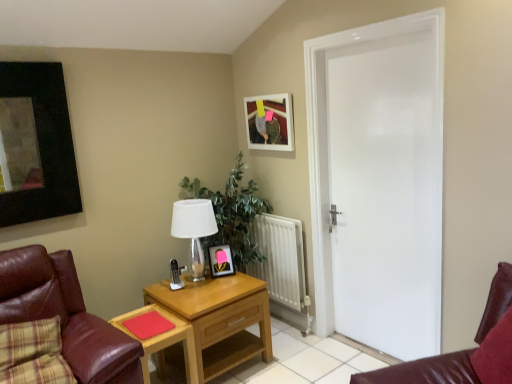
The height and width of the screenshot is (384, 512). I want to click on white glass table lamp at center, so click(194, 230).

This screenshot has height=384, width=512. Describe the element at coordinates (378, 181) in the screenshot. I see `white glossy door at right` at that location.

Describe the element at coordinates (221, 261) in the screenshot. I see `matte black picture frame at center, which is counted as the first picture frame, starting from the bottom` at that location.

This screenshot has width=512, height=384. What do you see at coordinates (220, 319) in the screenshot?
I see `wooden nightstand at center` at bounding box center [220, 319].

Identify the location of green leafy plant at center. (231, 214).

The height and width of the screenshot is (384, 512). I want to click on white glass table lamp at center, so click(194, 230).

Is white metallic radiator at center in front of or behind matte black picture frame at center, the 2th picture frame from the right, in the image?

In the image, white metallic radiator at center appears behind matte black picture frame at center, the 2th picture frame from the right.

Between white metallic radiator at center and matte black picture frame at center, the 1th picture frame from the left, which one has larger size?

white metallic radiator at center is bigger.

Looking at this image, is white metallic radiator at center facing away from matte black picture frame at center, which is counted as the first picture frame, starting from the bottom?

That's not correct — white metallic radiator at center is not looking away from matte black picture frame at center, which is counted as the first picture frame, starting from the bottom.

Is white metallic radiator at center positioned beyond the bounds of matte black picture frame at center, which is counted as the first picture frame, starting from the bottom?

Absolutely, white metallic radiator at center is external to matte black picture frame at center, which is counted as the first picture frame, starting from the bottom.

From a real-world perspective, relative to white glass table lamp at center, is green leafy plant at center vertically above or below?

In terms of real-world spatial position, green leafy plant at center is below white glass table lamp at center.

Is green leafy plant at center directly adjacent to white glass table lamp at center?

No, green leafy plant at center is not next to white glass table lamp at center.

In the image, is green leafy plant at center positioned in front of or behind white glass table lamp at center?

In the image, green leafy plant at center appears behind white glass table lamp at center.

Considering the positions of point (216, 238) and point (180, 237), is point (216, 238) closer or farther from the camera than point (180, 237)?

Point (216, 238).

How different are the orientations of white glass table lamp at center and matte black picture frame at center, which is counted as the first picture frame, starting from the bottom, in degrees?

The angle between the facing direction of white glass table lamp at center and the facing direction of matte black picture frame at center, which is counted as the first picture frame, starting from the bottom, is 24.7 degrees.

From a real-world perspective, which is physically above, white glass table lamp at center or matte black picture frame at center, the 2th picture frame from the right?

In real-world perspective, white glass table lamp at center is above.

Which is in front, point (201, 271) or point (219, 256)?

The point (201, 271) is in front.

Considering the sizes of objects white glass table lamp at center and matte black picture frame at center, which is counted as the first picture frame, starting from the bottom, in the image provided, who is thinner, white glass table lamp at center or matte black picture frame at center, which is counted as the first picture frame, starting from the bottom,?

matte black picture frame at center, which is counted as the first picture frame, starting from the bottom.

Is matte black picture frame at center, placed as the 2th picture frame when sorted from top to bottom, to the right of white glossy door at right from the viewer's perspective?

Incorrect, matte black picture frame at center, placed as the 2th picture frame when sorted from top to bottom, is not on the right side of white glossy door at right.

Based on the photo, considering the relative sizes of matte black picture frame at center, the 2th picture frame from the right, and white glossy door at right in the image provided, is matte black picture frame at center, the 2th picture frame from the right, bigger than white glossy door at right?

Incorrect, matte black picture frame at center, the 2th picture frame from the right, is not larger than white glossy door at right.

Is matte black picture frame at center, which is counted as the first picture frame, starting from the bottom, taller than white glossy door at right?

No, matte black picture frame at center, which is counted as the first picture frame, starting from the bottom, is not taller than white glossy door at right.

In the image, is matte black picture frame at center, placed as the 2th picture frame when sorted from top to bottom, positioned in front of or behind white glossy door at right?

matte black picture frame at center, placed as the 2th picture frame when sorted from top to bottom, is behind white glossy door at right.

Between white glass table lamp at center and wooden nightstand at center, which one has larger size?

wooden nightstand at center.

Can you tell me how much white glass table lamp at center and wooden nightstand at center differ in facing direction?

They differ by 0.000782 degrees in their facing directions.

Which object is thinner, white glass table lamp at center or wooden nightstand at center?

With smaller width is white glass table lamp at center.

Is white glass table lamp at center inside or outside of wooden nightstand at center?

white glass table lamp at center is not enclosed by wooden nightstand at center.

Does leather at left have a greater width compared to white metallic radiator at center?

Correct, the width of leather at left exceeds that of white metallic radiator at center.

From a real-world perspective, who is located lower, leather at left or white metallic radiator at center?

white metallic radiator at center is physically lower.

Is leather at left inside or outside of white metallic radiator at center?

leather at left lies outside white metallic radiator at center.

Is white glossy door at right not close to leather at left?

Yes, white glossy door at right is far from leather at left.

Does white glossy door at right have a greater height compared to leather at left?

Correct, white glossy door at right is much taller as leather at left.

Is white glossy door at right oriented towards leather at left?

Yes, white glossy door at right is oriented towards leather at left.

Is leather at left surrounded by white glossy door at right?

Actually, leather at left is outside white glossy door at right.

Find the location of `radiator lying below the matte black picture frame at center, the 2th picture frame from the right (from the image's perspective)`. radiator lying below the matte black picture frame at center, the 2th picture frame from the right (from the image's perspective) is located at coordinates (280, 259).

This screenshot has height=384, width=512. What are the coordinates of `table lamp lying in front of the green leafy plant at center` in the screenshot? It's located at (194, 230).

Based on their spatial positions, is white glossy door at right or white metallic radiator at center further from green leafy plant at center?

white glossy door at right lies further to green leafy plant at center than the other object.

From the image, which object appears to be nearer to smooth red paper at lower center, matte white picture frame at upper center, the second picture frame positioned from the bottom, or leather at left?

Based on the image, leather at left appears to be nearer to smooth red paper at lower center.

When comparing their distances from white glossy door at right, does leather at left or smooth red paper at lower center seem further?

The object further to white glossy door at right is leather at left.

Considering their positions, is white glossy door at right positioned further to wooden table at center than smooth red paper at lower center?

white glossy door at right lies further to wooden table at center than the other object.

Consider the image. Which object lies further to the anchor point green leafy plant at center, white metallic radiator at center or matte white picture frame at upper center, which is counted as the second picture frame, starting from the left?

Among the two, matte white picture frame at upper center, which is counted as the second picture frame, starting from the left, is located further to green leafy plant at center.

From the image, which object appears to be farther from matte black picture frame at center, which is counted as the first picture frame, starting from the bottom, matte white picture frame at upper center, which is counted as the second picture frame, starting from the left, or leather at left?

Among the two, leather at left is located further to matte black picture frame at center, which is counted as the first picture frame, starting from the bottom.

Estimate the real-world distances between objects in this image. Which object is further from wooden table at center, leather at left or white glossy door at right?

The object further to wooden table at center is white glossy door at right.

Looking at this image, based on their spatial positions, is wooden table at center or smooth red paper at lower center closer to matte white picture frame at upper center, the second picture frame positioned from the bottom?

Among the two, wooden table at center is located nearer to matte white picture frame at upper center, the second picture frame positioned from the bottom.

The width and height of the screenshot is (512, 384). Identify the location of chair between matte white picture frame at upper center, the first picture frame from the right, and wooden table at center from top to bottom. (66, 315).

You are a GUI agent. You are given a task and a screenshot of the screen. Output one action in this format:
    pyautogui.click(x=<x>, y=<y>)
    Task: Click on the desk between leather at left and white glass table lamp at center in the front-back direction
    
    Given the screenshot: What is the action you would take?
    pyautogui.click(x=164, y=340)

This screenshot has height=384, width=512. Identify the location of plant between matte white picture frame at upper center, the first picture frame positioned from the top, and wooden nightstand at center in the up-down direction. (231, 214).

The image size is (512, 384). In order to click on desk between smooth red paper at lower center and white glossy door at right in this screenshot , I will do `click(164, 340)`.